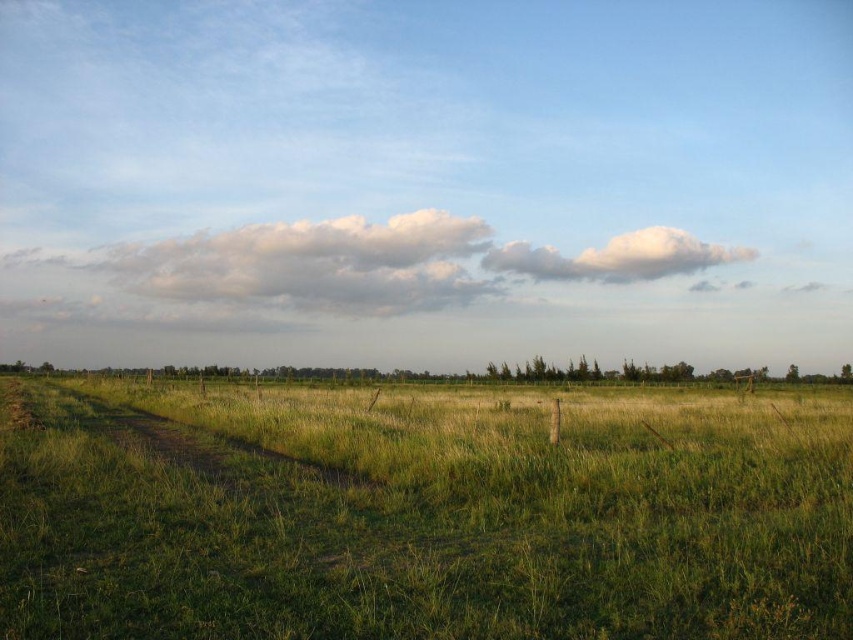
Does green grass at center lie in front of white fluffy cloud at upper center?

Yes, it is.

Can you confirm if green grass at center is positioned to the right of white fluffy cloud at upper center?

No, green grass at center is not to the right of white fluffy cloud at upper center.

Is point (851, 634) closer to camera compared to point (566, 280)?

Yes, it is.

Locate an element on the screen. This screenshot has height=640, width=853. green grass at center is located at coordinates (421, 513).